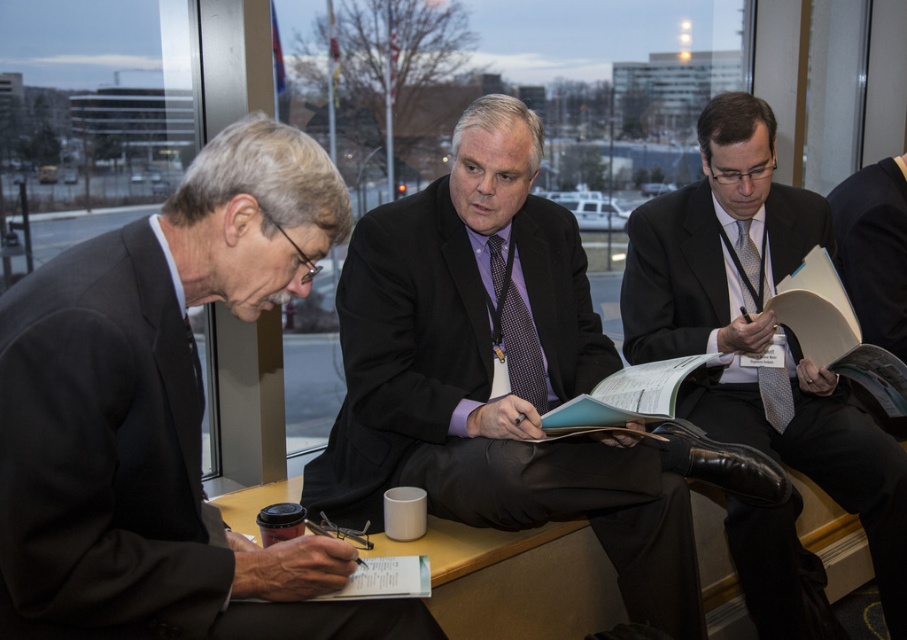
Who is positioned more to the left, matte black suit at left or matte purple tie at center?

Positioned to the left is matte black suit at left.

Is matte black suit at left wider than matte purple tie at center?

No, matte black suit at left is not wider than matte purple tie at center.

Does point (301, 243) lie behind point (454, 172)?

No, (301, 243) is in front of (454, 172).

The width and height of the screenshot is (907, 640). What are the coordinates of `matte black suit at left` in the screenshot? It's located at (162, 416).

Which of these two, matte black suit at left or matte black suit at center, stands shorter?

matte black suit at left

Is point (159, 408) behind point (670, 204)?

No, it is not.

Between point (420, 616) and point (715, 312), which one is positioned behind?

The point (715, 312) is more distant.

The width and height of the screenshot is (907, 640). Find the location of `matte black suit at left`. matte black suit at left is located at coordinates (162, 416).

Measure the distance between purple dotted tie at center and silver textured tie at center right.

purple dotted tie at center and silver textured tie at center right are 27.20 inches apart.

Based on the photo, does purple dotted tie at center appear on the right side of silver textured tie at center right?

In fact, purple dotted tie at center is to the left of silver textured tie at center right.

At what (x,y) coordinates should I click in order to perform the action: click on purple dotted tie at center. Please return your answer as a coordinate pair (x, y). Looking at the image, I should click on (515, 332).